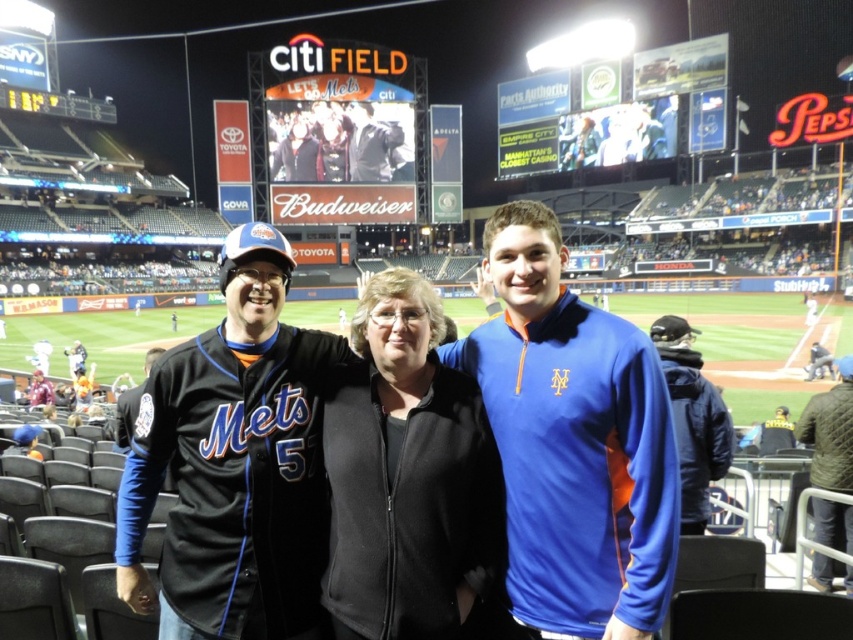
You are standing at the center of the field at Citi Field. You see a point marked at coordinates (280, 198). If you want to reach this point as quickly as possible, should you walk towards the left or right side of the field?

The point at coordinates (280, 198) is 144.18 meters away from the viewer. Since you are at the center, you should walk towards the right side of the field to reach it quickly.

You are a photographer at Citi Field and want to capture a photo that includes both the yellow plastic scoreboard at upper left and the dark blue jersey at left. Based on their positions, which object should appear higher in the image?

The yellow plastic scoreboard at upper left is located above the dark blue jersey at left, so it should appear higher in the image.

You are a photographer at Citi Field trying to capture a photo of the blue fleece jacket at center and the white digital display at upper center. Which object is shorter?

The blue fleece jacket at center is shorter than the white digital display at upper center.